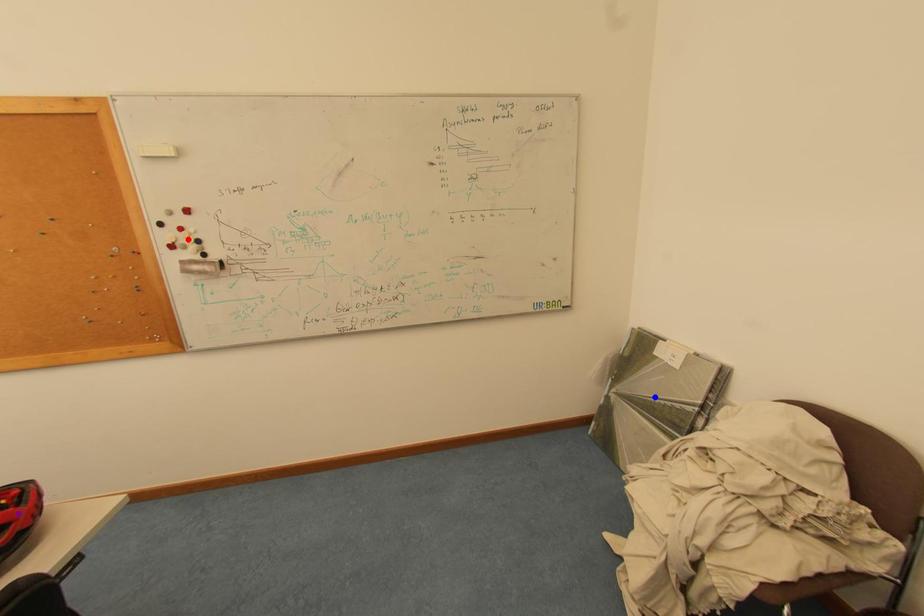
Consider the image. Order these from nearest to farthest:
blue point | red point | purple point

purple point
red point
blue point